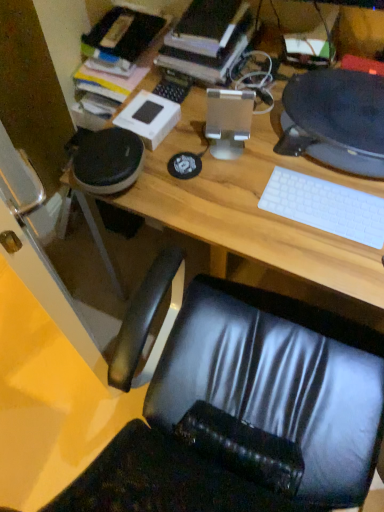
In order to click on vacant point above white matte keyboard at right (from a real-world perspective) in this screenshot , I will do `click(326, 201)`.